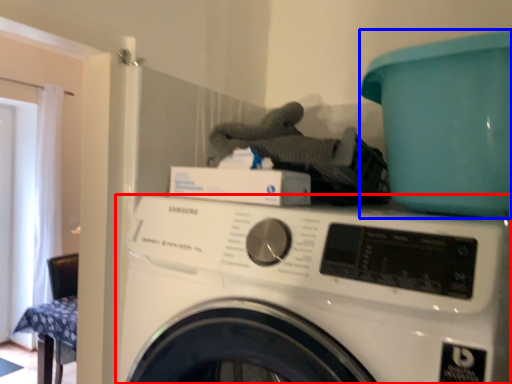
Question: Which of the following is the farthest to the observer, washing machine (highlighted by a red box) or teal (highlighted by a blue box)?

Choices:
 (A) washing machine
 (B) teal

Answer: (B)